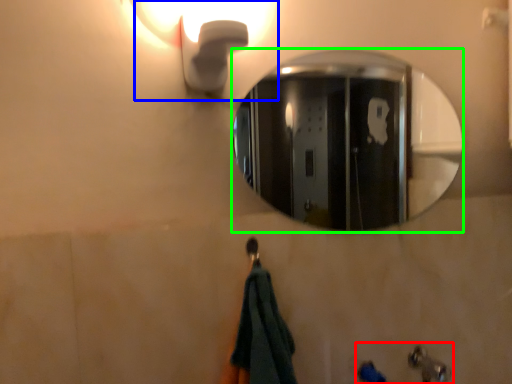
Question: Based on their relative distances, which object is nearer to sink (highlighted by a red box)? Choose from light fixture (highlighted by a blue box) and mirror (highlighted by a green box).

Choices:
 (A) light fixture
 (B) mirror

Answer: (A)